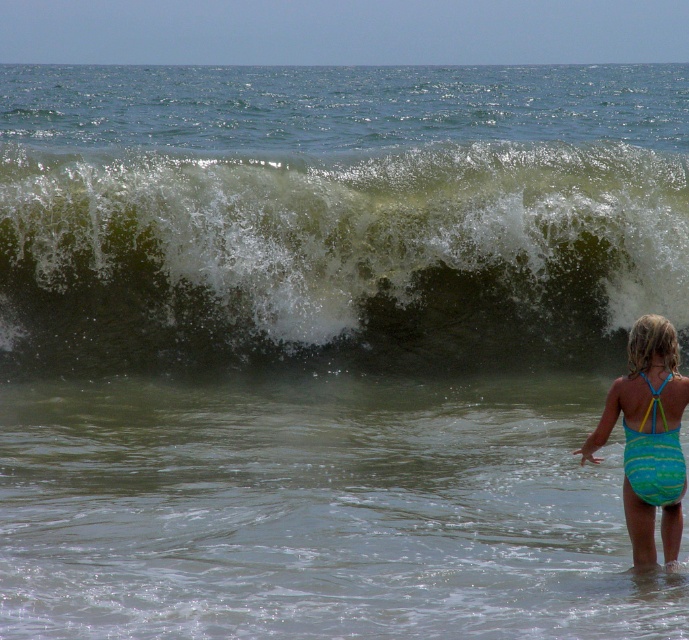
Between greenish-brown foam at upper center and blue striped swimsuit at lower right, which one has more height?

Standing taller between the two is greenish-brown foam at upper center.

Is greenish-brown foam at upper center bigger than blue striped swimsuit at lower right?

Yes.

Is point (205, 179) in front of point (659, 433)?

That is False.

In order to click on greenish-brown foam at upper center in this screenshot , I will do `click(336, 256)`.